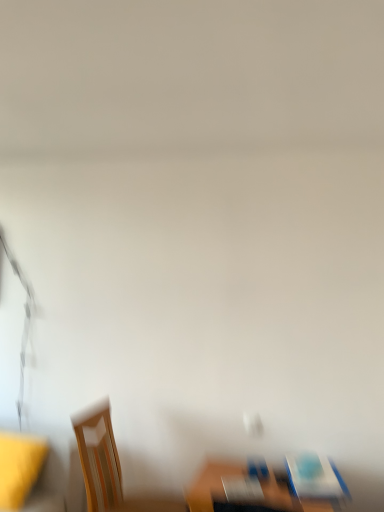
The width and height of the screenshot is (384, 512). Describe the element at coordinates (19, 467) in the screenshot. I see `yellow fabric at left` at that location.

Locate an element on the screen. Image resolution: width=384 pixels, height=512 pixels. matte wood chair at lower right, which is the first chair from right to left is located at coordinates (315, 481).

The image size is (384, 512). I want to click on wooden table at lower center, so click(267, 486).

Which object is thinner, yellow fabric at left or wooden chair at lower left, marked as the 2th chair in a right-to-left arrangement?

With smaller width is yellow fabric at left.

Is the surface of yellow fabric at left in direct contact with wooden chair at lower left, which ranks as the 2th chair in top-to-bottom order?

There is a gap between yellow fabric at left and wooden chair at lower left, which ranks as the 2th chair in top-to-bottom order.

Between point (1, 499) and point (91, 406), which one is positioned behind?

Point (91, 406)

Is wooden chair at lower left, which ranks as the 2th chair in top-to-bottom order, wider or thinner than wooden table at lower center?

Clearly, wooden chair at lower left, which ranks as the 2th chair in top-to-bottom order, has more width compared to wooden table at lower center.

Are wooden chair at lower left, marked as the 2th chair in a right-to-left arrangement, and wooden table at lower center located far from each other?

No, there isn't a large distance between wooden chair at lower left, marked as the 2th chair in a right-to-left arrangement, and wooden table at lower center.

Does wooden chair at lower left, which ranks as the 2th chair in top-to-bottom order, come in front of wooden table at lower center?

No, wooden chair at lower left, which ranks as the 2th chair in top-to-bottom order, is further to the viewer.

Where is `furniture that is below the wooden chair at lower left, the first chair when ordered from bottom to top (from the image's perspective)`? This screenshot has width=384, height=512. furniture that is below the wooden chair at lower left, the first chair when ordered from bottom to top (from the image's perspective) is located at coordinates (267, 486).

In terms of size, does yellow fabric at left appear bigger or smaller than matte wood chair at lower right, which is the 2th chair from left to right?

Considering their sizes, yellow fabric at left takes up more space than matte wood chair at lower right, which is the 2th chair from left to right.

Is yellow fabric at left next to matte wood chair at lower right, which is the first chair from right to left?

There is a gap between yellow fabric at left and matte wood chair at lower right, which is the first chair from right to left.

From a real-world perspective, is yellow fabric at left positioned over matte wood chair at lower right, acting as the 1th chair starting from the top, based on gravity?

Actually, yellow fabric at left is physically below matte wood chair at lower right, acting as the 1th chair starting from the top, in the real world.

What's the angular difference between yellow fabric at left and matte wood chair at lower right, which is the 2th chair from left to right,'s facing directions?

The angle between the facing direction of yellow fabric at left and the facing direction of matte wood chair at lower right, which is the 2th chair from left to right, is 12 degrees.

Looking at their sizes, would you say yellow fabric at left is wider or thinner than wooden table at lower center?

Considering their sizes, yellow fabric at left looks slimmer than wooden table at lower center.

Can you tell me how much yellow fabric at left and wooden table at lower center differ in facing direction?

yellow fabric at left and wooden table at lower center are facing 3.26 degrees away from each other.

Find the location of a particular element. Image resolution: width=384 pixels, height=512 pixels. furniture located on the right of yellow fabric at left is located at coordinates [267, 486].

From the image's perspective, does yellow fabric at left appear lower than wooden table at lower center?

No, from the image's perspective, yellow fabric at left is not beneath wooden table at lower center.

In the image, is wooden table at lower center on the left side or the right side of wooden chair at lower left, marked as the 2th chair in a right-to-left arrangement?

Based on their positions, wooden table at lower center is located to the right of wooden chair at lower left, marked as the 2th chair in a right-to-left arrangement.

Can we say wooden table at lower center lies outside wooden chair at lower left, the first chair when ordered from bottom to top?

Yes, wooden table at lower center is located beyond the bounds of wooden chair at lower left, the first chair when ordered from bottom to top.

Which is behind, point (242, 465) or point (178, 503)?

Point (242, 465)

From the image's perspective, which one is positioned higher, wooden table at lower center or wooden chair at lower left, marked as the 2th chair in a right-to-left arrangement?

From the image's view, wooden chair at lower left, marked as the 2th chair in a right-to-left arrangement, is above.

From a real-world perspective, between matte wood chair at lower right, acting as the 1th chair starting from the top, and wooden chair at lower left, which ranks as the 2th chair in top-to-bottom order, who is vertically higher?

In real-world perspective, matte wood chair at lower right, acting as the 1th chair starting from the top, is above.

Which object is further away from the camera taking this photo, matte wood chair at lower right, acting as the 1th chair starting from the top, or wooden chair at lower left, the first chair when ordered from bottom to top?

wooden chair at lower left, the first chair when ordered from bottom to top.

Does matte wood chair at lower right, which is the second chair from bottom to top, have a lesser width compared to wooden chair at lower left, the first chair when ordered from bottom to top?

Correct, the width of matte wood chair at lower right, which is the second chair from bottom to top, is less than that of wooden chair at lower left, the first chair when ordered from bottom to top.

How different are the orientations of matte wood chair at lower right, which is the 2th chair from left to right, and wooden table at lower center in degrees?

8.73 degrees.

Does point (321, 458) lie behind point (270, 507)?

Yes, point (321, 458) is behind point (270, 507).

From a real-world perspective, is matte wood chair at lower right, which is the 2th chair from left to right, physically located above or below wooden table at lower center?

In terms of real-world spatial position, matte wood chair at lower right, which is the 2th chair from left to right, is above wooden table at lower center.

At what (x,y) coordinates should I click in order to perform the action: click on the 1st chair to the right of the yellow fabric at left, counting from the anchor's position. Please return your answer as a coordinate pair (x, y). The image size is (384, 512). Looking at the image, I should click on [x=110, y=467].

At what (x,y) coordinates should I click in order to perform the action: click on furniture that appears below the wooden chair at lower left, marked as the 2th chair in a right-to-left arrangement (from a real-world perspective). Please return your answer as a coordinate pair (x, y). The width and height of the screenshot is (384, 512). Looking at the image, I should click on (267, 486).

Based on their spatial positions, is wooden chair at lower left, arranged as the first chair when viewed from the left, or matte wood chair at lower right, which is the first chair from right to left, closer to wooden table at lower center?

Among the two, matte wood chair at lower right, which is the first chair from right to left, is located nearer to wooden table at lower center.

When comparing their distances from wooden chair at lower left, marked as the 2th chair in a right-to-left arrangement, does wooden table at lower center or yellow fabric at left seem further?

The object further to wooden chair at lower left, marked as the 2th chair in a right-to-left arrangement, is wooden table at lower center.

In the scene shown: Considering their positions, is wooden chair at lower left, which ranks as the 2th chair in top-to-bottom order, positioned closer to wooden table at lower center than yellow fabric at left?

Based on the image, wooden chair at lower left, which ranks as the 2th chair in top-to-bottom order, appears to be nearer to wooden table at lower center.

Based on their spatial positions, is wooden chair at lower left, marked as the 2th chair in a right-to-left arrangement, or yellow fabric at left closer to matte wood chair at lower right, which is the second chair from bottom to top?

wooden chair at lower left, marked as the 2th chair in a right-to-left arrangement, is positioned closer to the anchor matte wood chair at lower right, which is the second chair from bottom to top.

Estimate the real-world distances between objects in this image. Which object is closer to wooden table at lower center, yellow fabric at left or wooden chair at lower left, arranged as the first chair when viewed from the left?

Among the two, wooden chair at lower left, arranged as the first chair when viewed from the left, is located nearer to wooden table at lower center.

Looking at this image, from the image, which object appears to be farther from yellow fabric at left, matte wood chair at lower right, acting as the 1th chair starting from the top, or wooden table at lower center?

matte wood chair at lower right, acting as the 1th chair starting from the top.

Considering their positions, is wooden chair at lower left, arranged as the first chair when viewed from the left, positioned further to matte wood chair at lower right, acting as the 1th chair starting from the top, than wooden table at lower center?

Among the two, wooden chair at lower left, arranged as the first chair when viewed from the left, is located further to matte wood chair at lower right, acting as the 1th chair starting from the top.

Considering their positions, is wooden chair at lower left, marked as the 2th chair in a right-to-left arrangement, positioned further to yellow fabric at left than wooden table at lower center?

wooden table at lower center is further to yellow fabric at left.

Where is `furniture between wooden chair at lower left, arranged as the first chair when viewed from the left, and matte wood chair at lower right, which is the first chair from right to left, in the horizontal direction`? furniture between wooden chair at lower left, arranged as the first chair when viewed from the left, and matte wood chair at lower right, which is the first chair from right to left, in the horizontal direction is located at coordinates coord(267,486).

Identify the location of chair between yellow fabric at left and wooden table at lower center in the horizontal direction. (110, 467).

What are the coordinates of `furniture situated between yellow fabric at left and matte wood chair at lower right, which is the 2th chair from left to right, from left to right` in the screenshot? It's located at (267, 486).

Locate an element on the screen. This screenshot has width=384, height=512. chair between yellow fabric at left and matte wood chair at lower right, which is the 2th chair from left to right, from left to right is located at coordinates (110, 467).